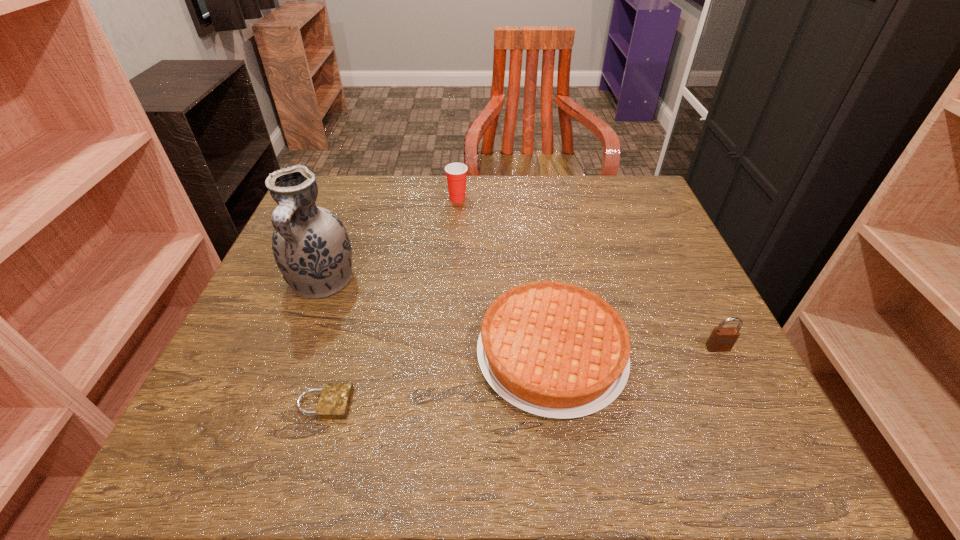
I want to click on vacant point located on the front of the Dixie cup, so click(x=455, y=238).

Identify the location of free space located on the front-facing side of the rightmost object. This screenshot has width=960, height=540. (766, 446).

This screenshot has height=540, width=960. I want to click on free spot located on the left of the pie, so (x=345, y=354).

You are a GUI agent. You are given a task and a screenshot of the screen. Output one action in this format:
    pyautogui.click(x=<x>, y=<y>)
    Task: Click on the free point located 0.210m on the keyhole side of the nearer padlock
    
    Given the screenshot: What is the action you would take?
    pyautogui.click(x=477, y=403)

Locate an element on the screen. This screenshot has height=540, width=960. object at the far edge is located at coordinates (456, 173).

Locate an element on the screen. The height and width of the screenshot is (540, 960). pie at the near edge is located at coordinates coord(556,350).

Identify the location of padlock positioned at the near edge. (334, 401).

Locate an element on the screen. Image resolution: width=960 pixels, height=540 pixels. vase at the left edge is located at coordinates (311, 247).

Image resolution: width=960 pixels, height=540 pixels. I want to click on padlock located in the left edge section of the desktop, so (334, 401).

At what (x,y) coordinates should I click in order to perform the action: click on object present at the right edge. Please return your answer as a coordinate pair (x, y). This screenshot has height=540, width=960. Looking at the image, I should click on (722, 339).